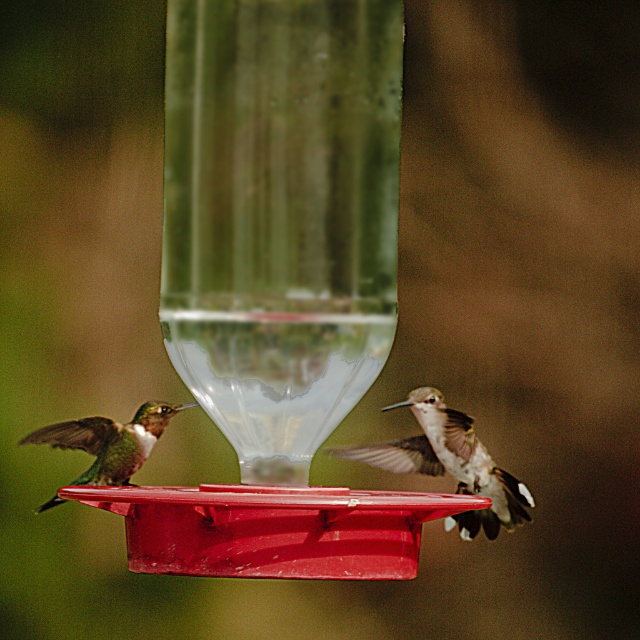
Question: Does white iridescent feathers at right have a larger size compared to shiny green hummingbird at left?

Choices:
 (A) no
 (B) yes

Answer: (B)

Question: Which object is positioned farthest from the white iridescent feathers at right?

Choices:
 (A) shiny green hummingbird at left
 (B) matte plastic bird feeder at center

Answer: (B)

Question: Can you confirm if matte plastic bird feeder at center is positioned below shiny green hummingbird at left?

Choices:
 (A) no
 (B) yes

Answer: (A)

Question: Which is farther from the matte plastic bird feeder at center?

Choices:
 (A) white iridescent feathers at right
 (B) shiny green hummingbird at left

Answer: (A)

Question: Can you confirm if white iridescent feathers at right is positioned to the right of shiny green hummingbird at left?

Choices:
 (A) no
 (B) yes

Answer: (B)

Question: Which point is farther to the camera?

Choices:
 (A) matte plastic bird feeder at center
 (B) shiny green hummingbird at left
 (C) white iridescent feathers at right

Answer: (C)